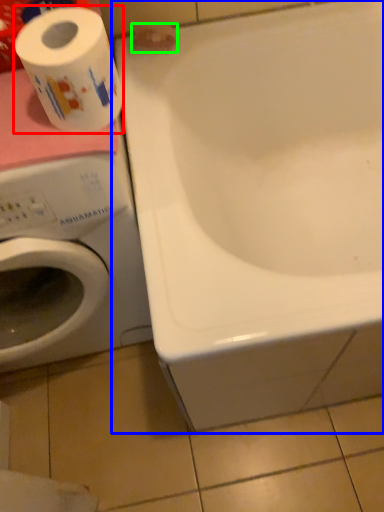
Question: Considering the real-world distances, which object is closest to toilet paper (highlighted by a red box)? bathtub (highlighted by a blue box) or toilet paper (highlighted by a green box).

Choices:
 (A) bathtub
 (B) toilet paper

Answer: (B)